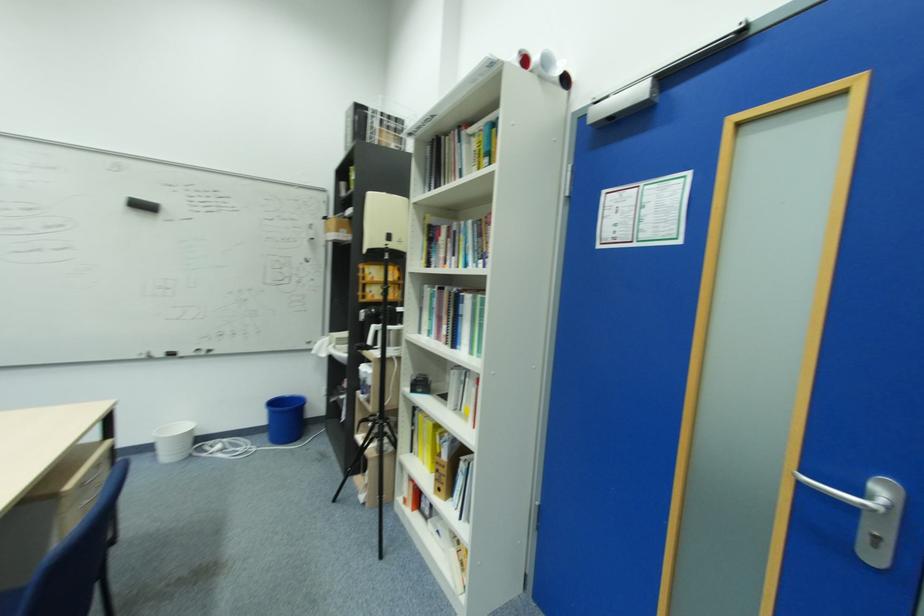
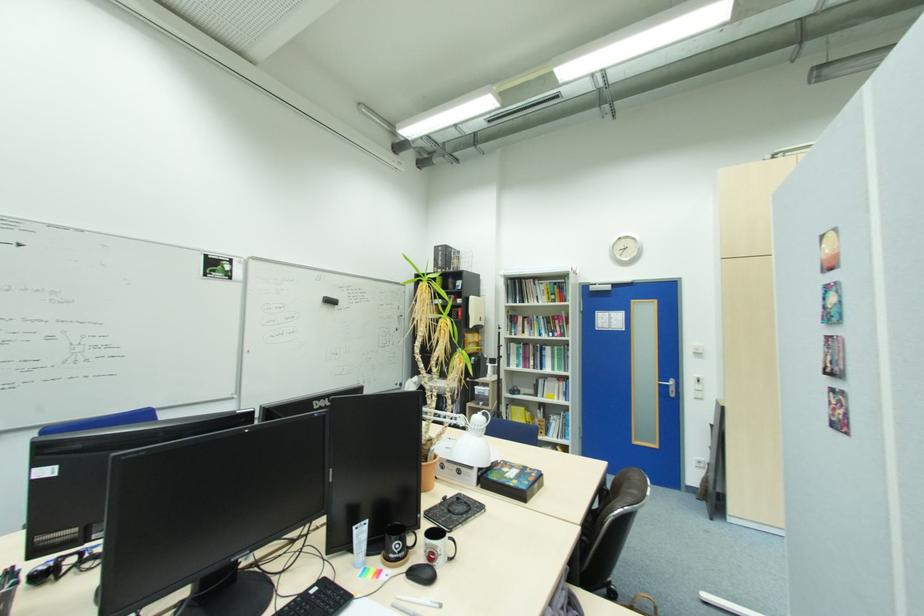
Locate, in the second image, the point that corresponds to pixel 483 297 in the first image.

(560, 347)